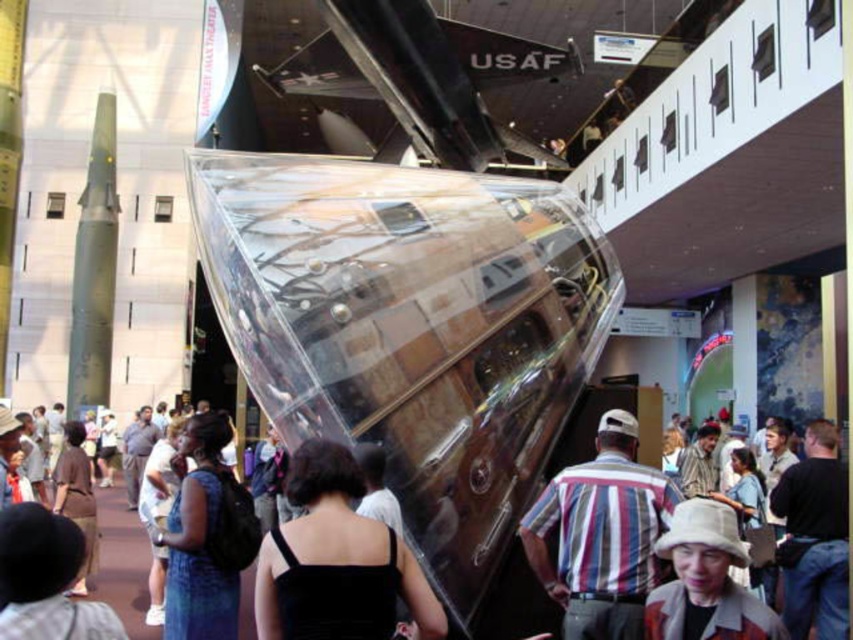
Question: Among these points, which one is nearest to the camera?

Choices:
 (A) (355, 554)
 (B) (596, 496)

Answer: (A)

Question: Can you confirm if black fabric dress at center is positioned below striped cotton shirt at center?

Choices:
 (A) no
 (B) yes

Answer: (A)

Question: Which point is closer to the camera?

Choices:
 (A) (579, 609)
 (B) (323, 516)

Answer: (B)

Question: Does black fabric dress at center appear over striped cotton shirt at center?

Choices:
 (A) no
 (B) yes

Answer: (B)

Question: Can you confirm if black fabric dress at center is thinner than striped cotton shirt at center?

Choices:
 (A) yes
 (B) no

Answer: (B)